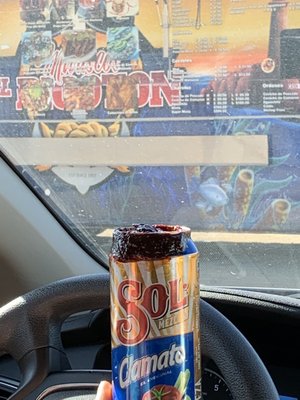
You are a GUI agent. You are given a task and a screenshot of the screen. Output one action in this format:
    pyautogui.click(x=<x>, y=<y>)
    Task: Click on the poster
    
    Given the screenshot: What is the action you would take?
    pyautogui.click(x=215, y=126)